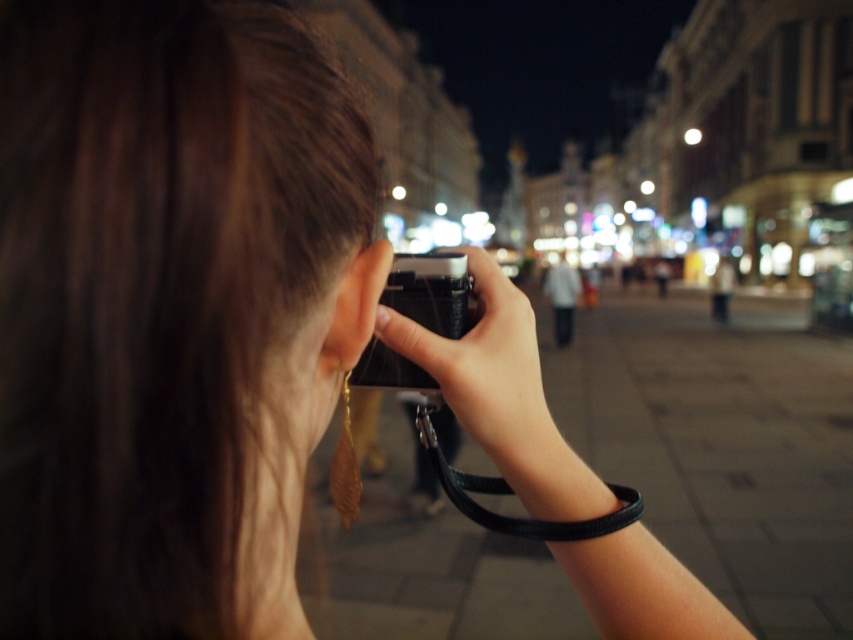
How distant is black matte camera at center from black plastic camera at center?

The distance of black matte camera at center from black plastic camera at center is 1.49 inches.

Who is more distant from viewer, (537,355) or (378,372)?

Point (378,372)

Is point (552, 426) more distant than point (450, 337)?

Yes, point (552, 426) is farther from viewer.

The height and width of the screenshot is (640, 853). In order to click on black matte camera at center in this screenshot , I will do `click(486, 371)`.